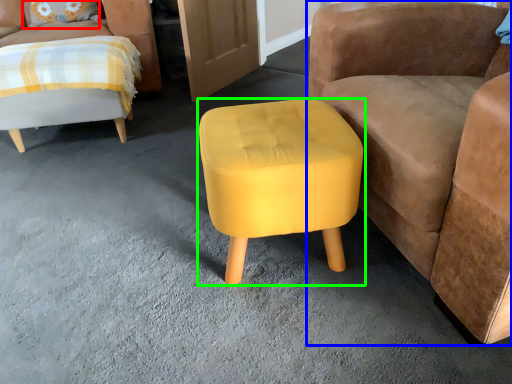
Question: Estimate the real-world distances between objects in this image. Which object is farther from pillow (highlighted by a red box), chair (highlighted by a blue box) or stool (highlighted by a green box)?

Choices:
 (A) chair
 (B) stool

Answer: (A)